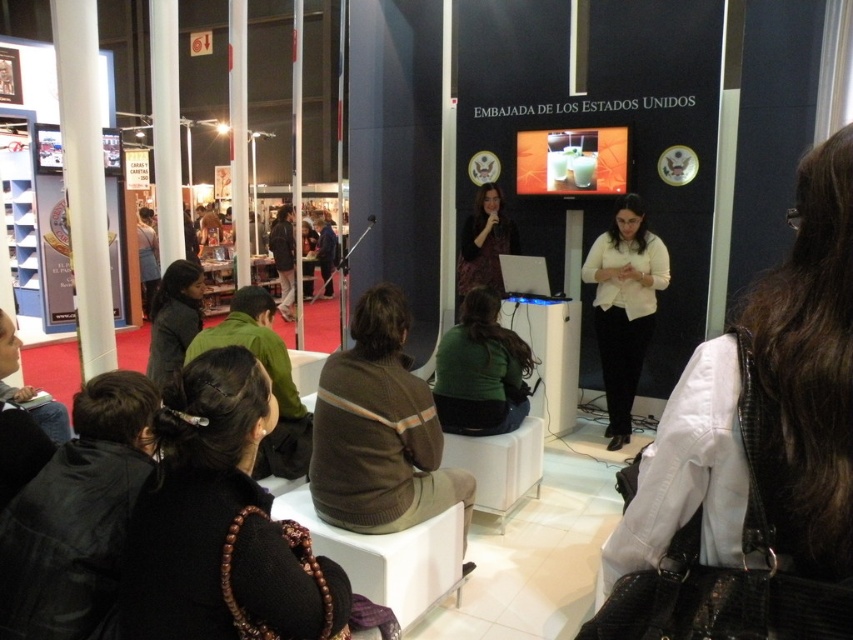
Is dark gray sweater at lower left positioned in front of shiny purple dress at center?

Yes, dark gray sweater at lower left is closer to the viewer.

What do you see at coordinates (173, 320) in the screenshot? The image size is (853, 640). I see `dark gray sweater at lower left` at bounding box center [173, 320].

Is point (173, 314) positioned after point (492, 212)?

No, (173, 314) is closer to viewer.

At what (x,y) coordinates should I click in order to perform the action: click on dark gray sweater at lower left. Please return your answer as a coordinate pair (x, y). The image size is (853, 640). Looking at the image, I should click on (173, 320).

Does green matte sweater at center have a lesser height compared to shiny purple dress at center?

Yes, green matte sweater at center is shorter than shiny purple dress at center.

Is green matte sweater at center below shiny purple dress at center?

Indeed, green matte sweater at center is positioned under shiny purple dress at center.

This screenshot has height=640, width=853. Identify the location of green matte sweater at center. (480, 371).

The image size is (853, 640). What are the coordinates of `white matte shirt at center` in the screenshot? It's located at (753, 456).

Is point (708, 433) positioned before point (469, 388)?

Yes, point (708, 433) is in front of point (469, 388).

Who is more distant from viewer, (828, 420) or (462, 426)?

The point (462, 426) is more distant.

You are a GUI agent. You are given a task and a screenshot of the screen. Output one action in this format:
    pyautogui.click(x=<x>, y=<y>)
    Task: Click on the white matte shirt at center
    
    Given the screenshot: What is the action you would take?
    pyautogui.click(x=753, y=456)